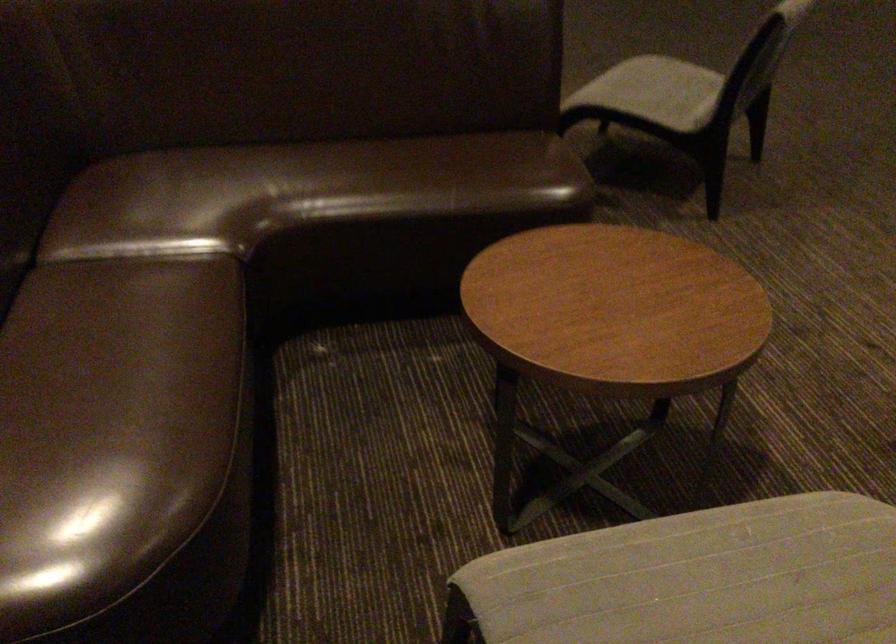
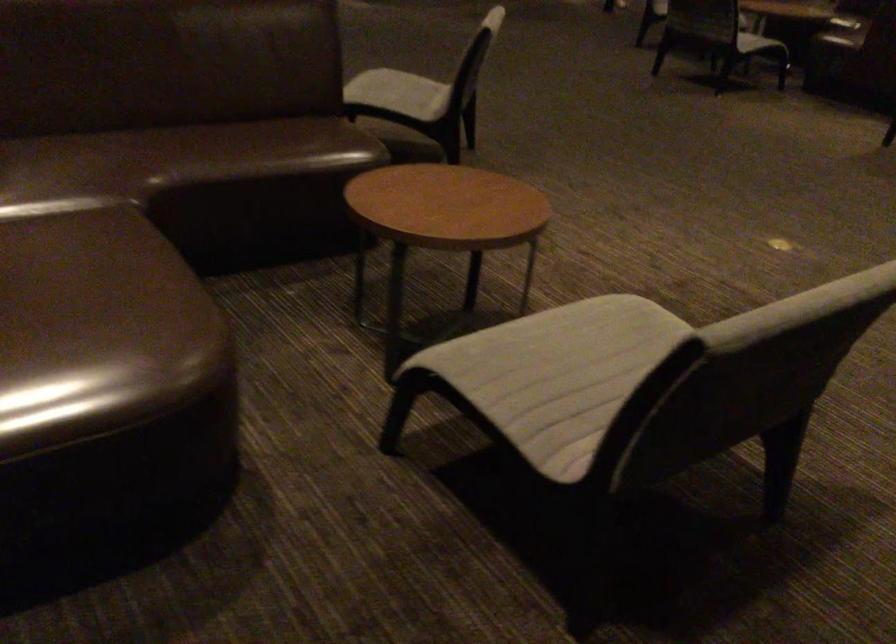
Question: The camera is either moving clockwise (left) or counter-clockwise (right) around the object. The first image is from the beginning of the video and the second image is from the end. Is the camera moving left or right when shooting the video?

Choices:
 (A) Left
 (B) Right

Answer: (A)